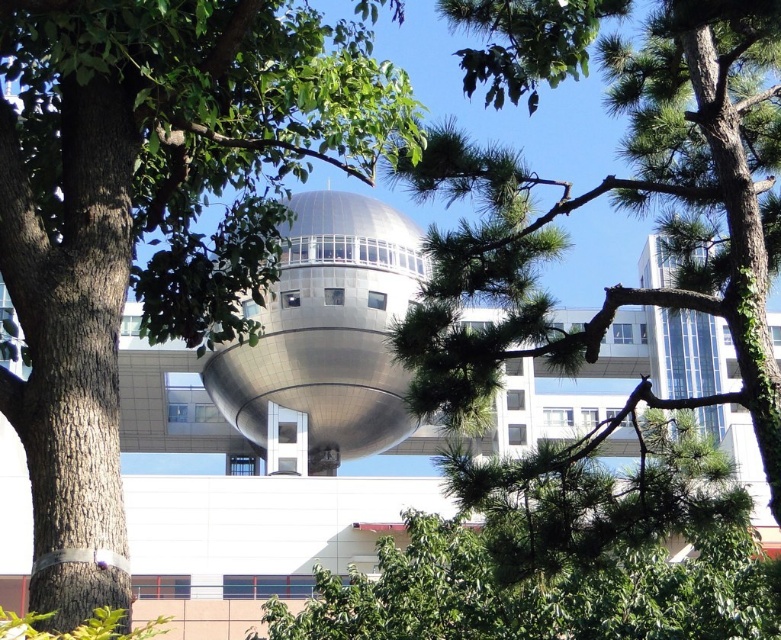
Who is positioned more to the right, green leafy tree at center or green needle-like leaves at center?

green needle-like leaves at center is more to the right.

Does green leafy tree at center appear on the left side of green needle-like leaves at center?

Yes, green leafy tree at center is to the left of green needle-like leaves at center.

At what (x,y) coordinates should I click in order to perform the action: click on green leafy tree at center. Please return your answer as a coordinate pair (x, y). The height and width of the screenshot is (640, 781). Looking at the image, I should click on (152, 216).